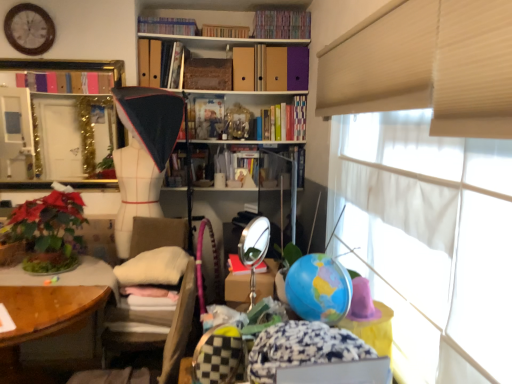
You are a GUI agent. You are given a task and a screenshot of the screen. Output one action in this format:
    pyautogui.click(x=<x>, y=<y>)
    Task: Click on the vacant area that lies between hardcover book at upper center, the fourth book ordered from the bottom, and hardcover books at upper center, the second book when ordered from top to bottom
    The width and height of the screenshot is (512, 384).
    Given the screenshot: What is the action you would take?
    pyautogui.click(x=176, y=33)